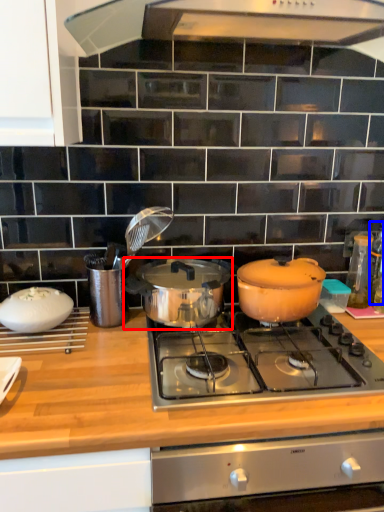
Question: Among these objects, which one is farthest to the camera, pot/pan (highlighted by a red box) or bottle (highlighted by a blue box)?

Choices:
 (A) pot/pan
 (B) bottle

Answer: (B)